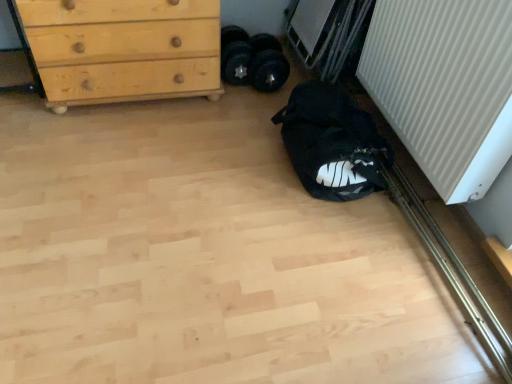
Question: In terms of height, does light wood/texture chest of drawers at upper left look taller or shorter compared to white ribbed radiator at right?

Choices:
 (A) tall
 (B) short

Answer: (B)

Question: Would you say light wood/texture chest of drawers at upper left is to the left or to the right of white ribbed radiator at right in the picture?

Choices:
 (A) left
 (B) right

Answer: (A)

Question: Estimate the real-world distances between objects in this image. Which object is farther from the black fabric bag at lower right?

Choices:
 (A) light wood/texture chest of drawers at upper left
 (B) white ribbed radiator at right

Answer: (A)

Question: Which of these objects is positioned farthest from the black fabric bag at lower right?

Choices:
 (A) white ribbed radiator at right
 (B) light wood/texture chest of drawers at upper left

Answer: (B)